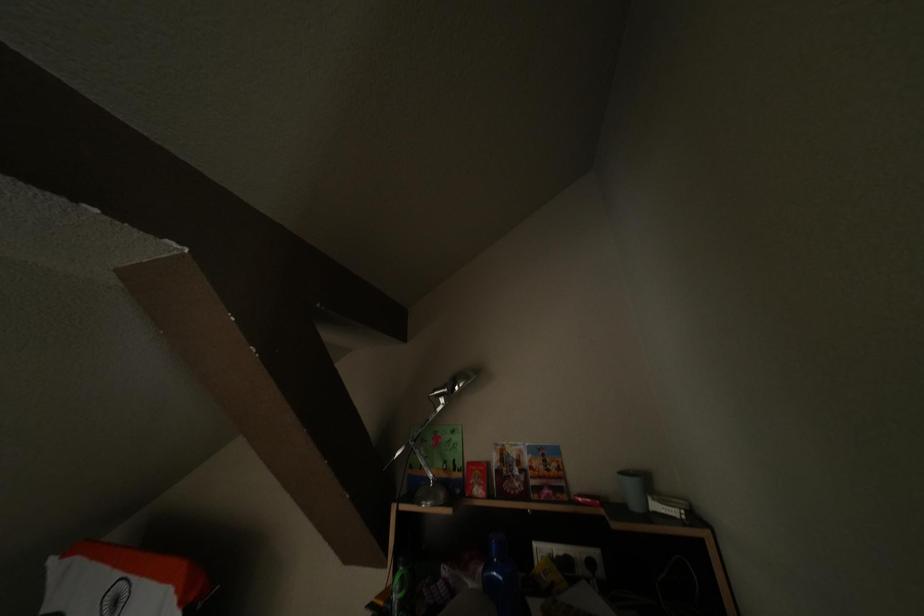
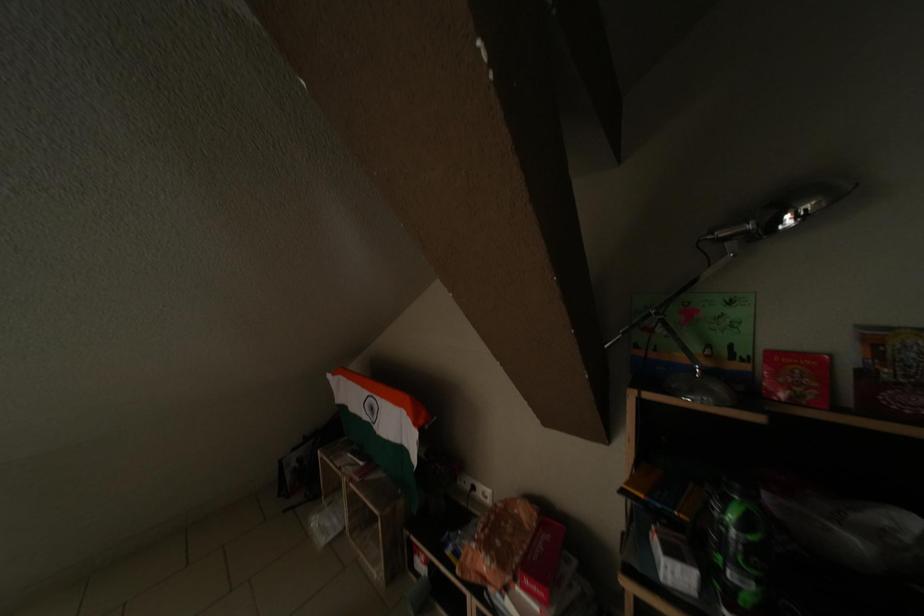
Based on the continuous images, in which direction is the camera rotating?

The camera rotated toward left-down.